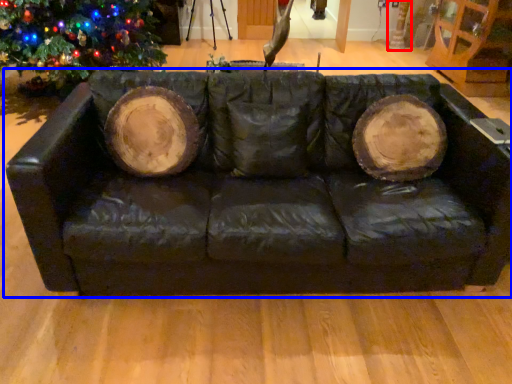
Question: Which object is further to the camera taking this photo, tree trunk (highlighted by a red box) or studio couch (highlighted by a blue box)?

Choices:
 (A) tree trunk
 (B) studio couch

Answer: (A)